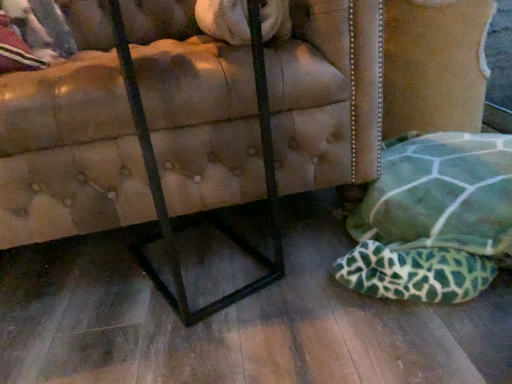
Question: Is green fabric cushion at lower right wider than leather tufted ottoman at lower right?

Choices:
 (A) no
 (B) yes

Answer: (A)

Question: Would you say green fabric cushion at lower right is a long distance from leather tufted ottoman at lower right?

Choices:
 (A) yes
 (B) no

Answer: (B)

Question: Can you confirm if green fabric cushion at lower right is thinner than leather tufted ottoman at lower right?

Choices:
 (A) no
 (B) yes

Answer: (B)

Question: From the image's perspective, is green fabric cushion at lower right on top of leather tufted ottoman at lower right?

Choices:
 (A) yes
 (B) no

Answer: (B)

Question: From a real-world perspective, is green fabric cushion at lower right below leather tufted ottoman at lower right?

Choices:
 (A) yes
 (B) no

Answer: (A)

Question: Is green fabric cushion at lower right at the left side of leather tufted ottoman at lower right?

Choices:
 (A) yes
 (B) no

Answer: (B)

Question: Is leather tufted ottoman at lower right bigger than green fabric cushion at lower right?

Choices:
 (A) yes
 (B) no

Answer: (A)

Question: Is leather tufted ottoman at lower right facing away from green fabric cushion at lower right?

Choices:
 (A) yes
 (B) no

Answer: (B)

Question: From a real-world perspective, is leather tufted ottoman at lower right located beneath green fabric cushion at lower right?

Choices:
 (A) yes
 (B) no

Answer: (B)

Question: Is leather tufted ottoman at lower right not close to green fabric cushion at lower right?

Choices:
 (A) yes
 (B) no

Answer: (B)

Question: Considering the relative sizes of leather tufted ottoman at lower right and green fabric cushion at lower right in the image provided, is leather tufted ottoman at lower right taller than green fabric cushion at lower right?

Choices:
 (A) no
 (B) yes

Answer: (B)

Question: Does leather tufted ottoman at lower right turn towards green fabric cushion at lower right?

Choices:
 (A) yes
 (B) no

Answer: (B)

Question: Looking at their shapes, would you say leather tufted ottoman at lower right is wider or thinner than green fabric cushion at lower right?

Choices:
 (A) wide
 (B) thin

Answer: (A)